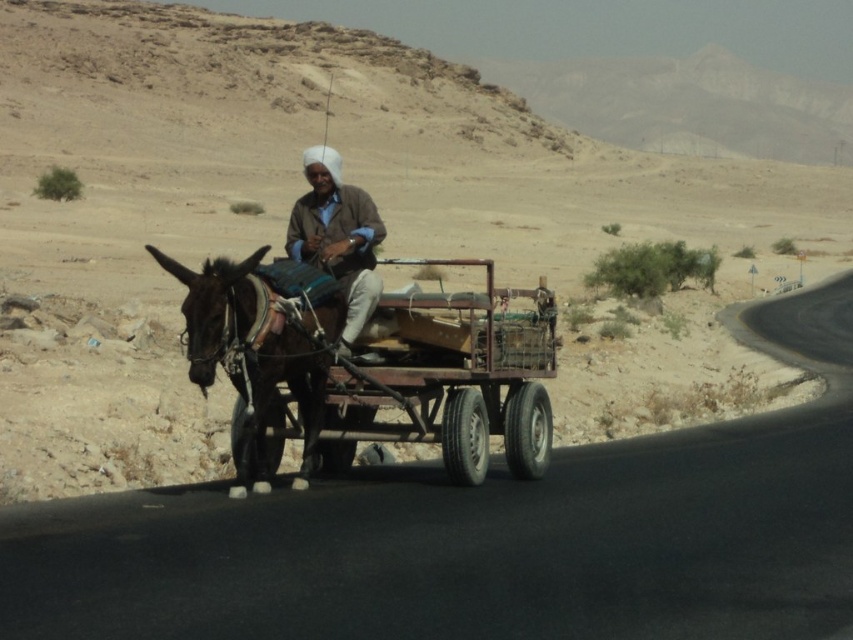
You are a traveler in the desert and see a shiny black horse at center and a brown woolen sweater at center. Which object is taller?

The shiny black horse at center is taller than the brown woolen sweater at center.

You are standing at the edge of the desert road and see two points in the image. The first point is at coordinate point (305, 397) and the second is at coordinate point (338, 300). Which point is closer to you?

Point (305, 397) is closer to you because it is further to the camera than point (338, 300).

You are a traveler in the desert and see the rustic wooden cart at center and the shiny black horse at center. Which one is to the right?

The rustic wooden cart at center is positioned on the right side of the shiny black horse at center, so it is to the right.